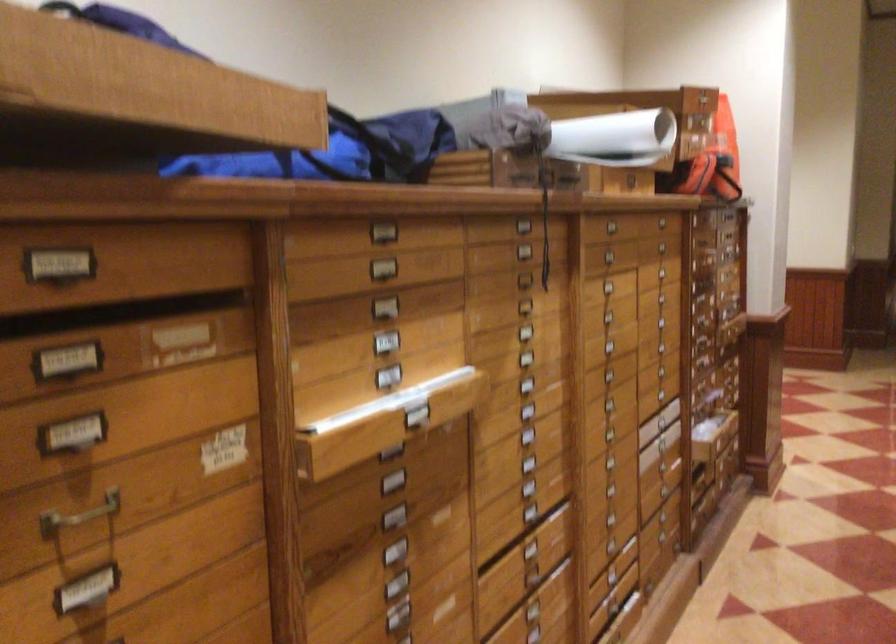
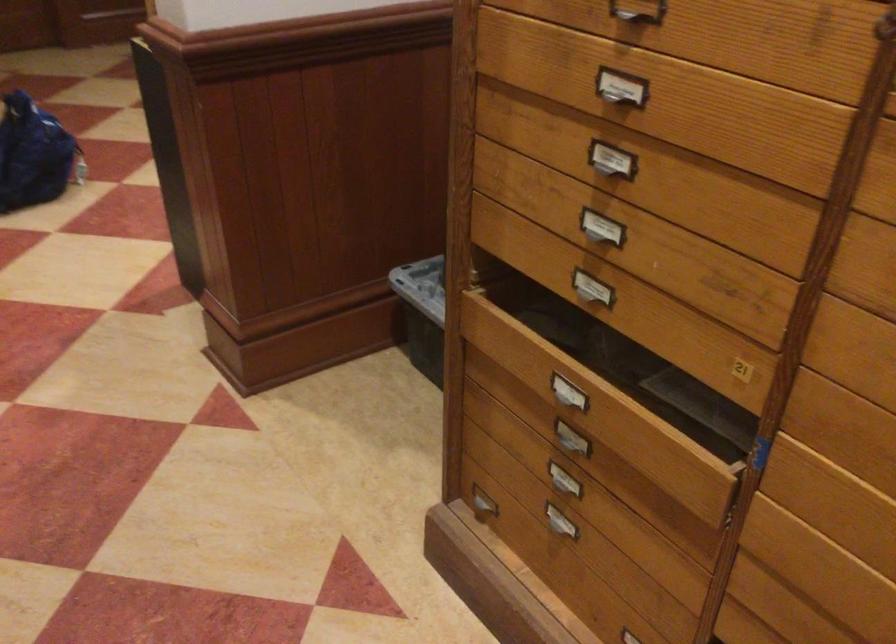
The first image is from the beginning of the video and the second image is from the end. How did the camera likely rotate when shooting the video?

The rotation direction of the camera is left-down.